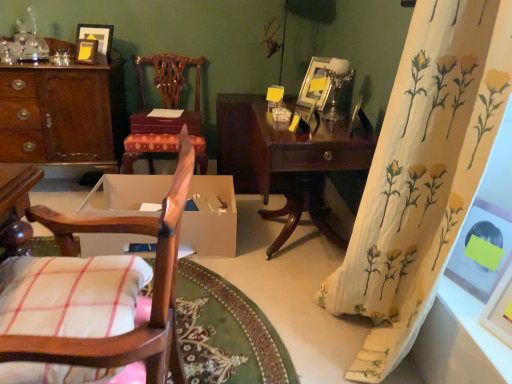
Locate an element on the screen. This screenshot has width=512, height=384. vacant location behind matte white picture frame at right, positioned as the fifth picture frame in left-to-right order is located at coordinates (459, 300).